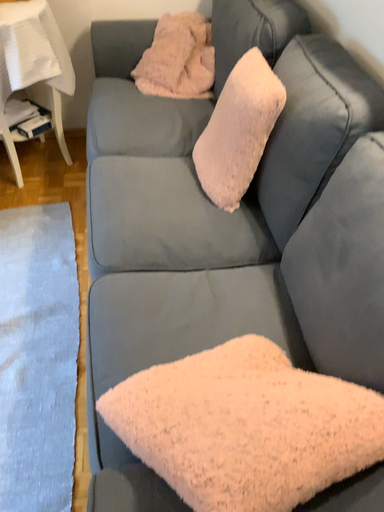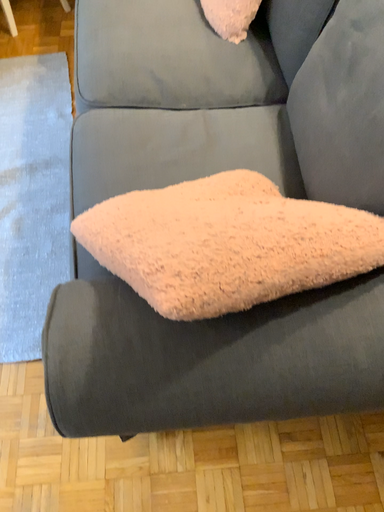
Question: How did the camera likely rotate when shooting the video?

Choices:
 (A) rotated upward
 (B) rotated downward

Answer: (B)